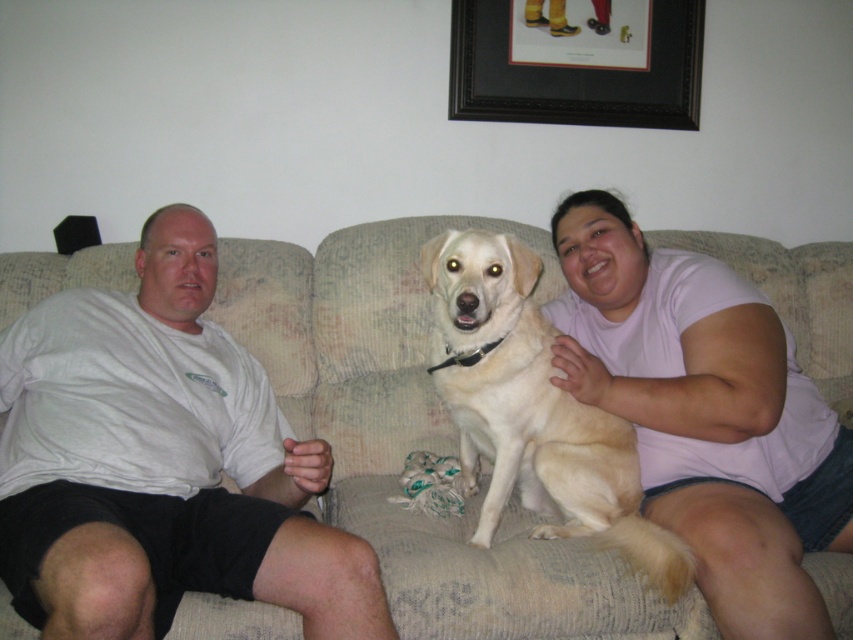
Looking at this image, based on the scene description, which object is positioned lower between the white cotton shirt at left and the matte pink shirt at center?

The white cotton shirt at left is positioned lower than the matte pink shirt at center.

You are a furniture designer who wants to place a new lamp on the beige fabric couch at center. Considering the height of the light yellow fur at center, will the lamp be visible from the floor level?

The beige fabric couch at center is much taller than the light yellow fur at center, so placing the lamp on the couch will ensure it is visible from the floor level.